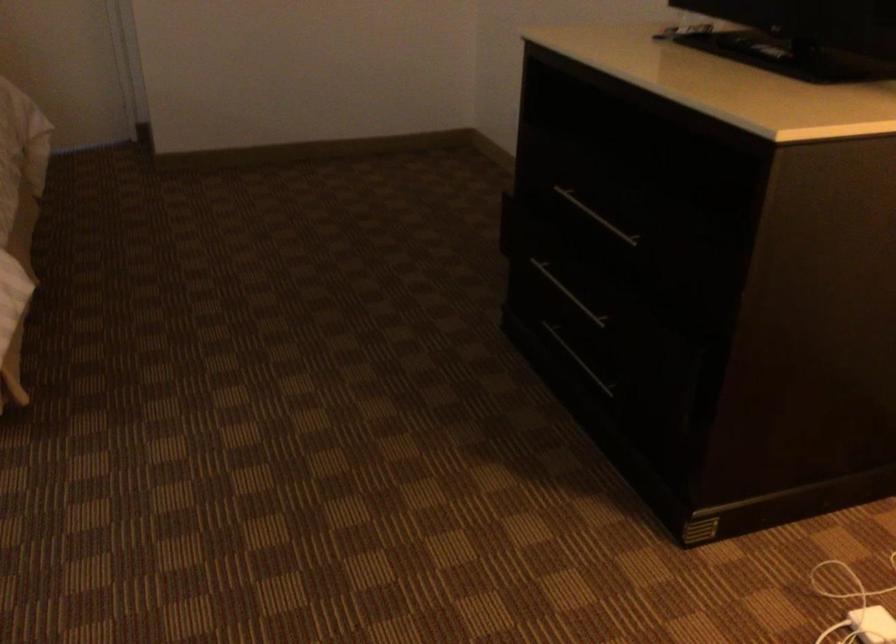
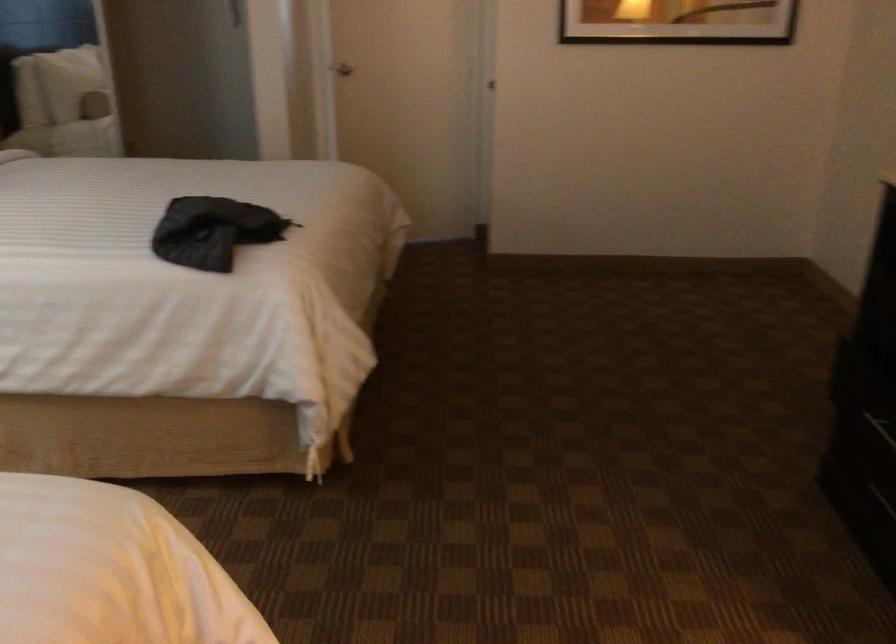
In a continuous first-person perspective shot, in which direction is the camera moving?

The cameraman moved toward left, backward.